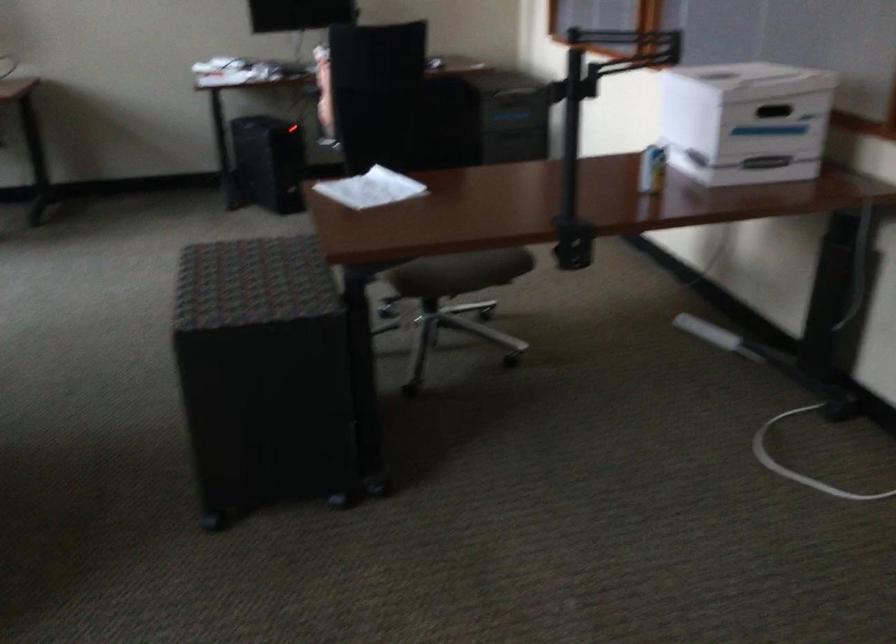
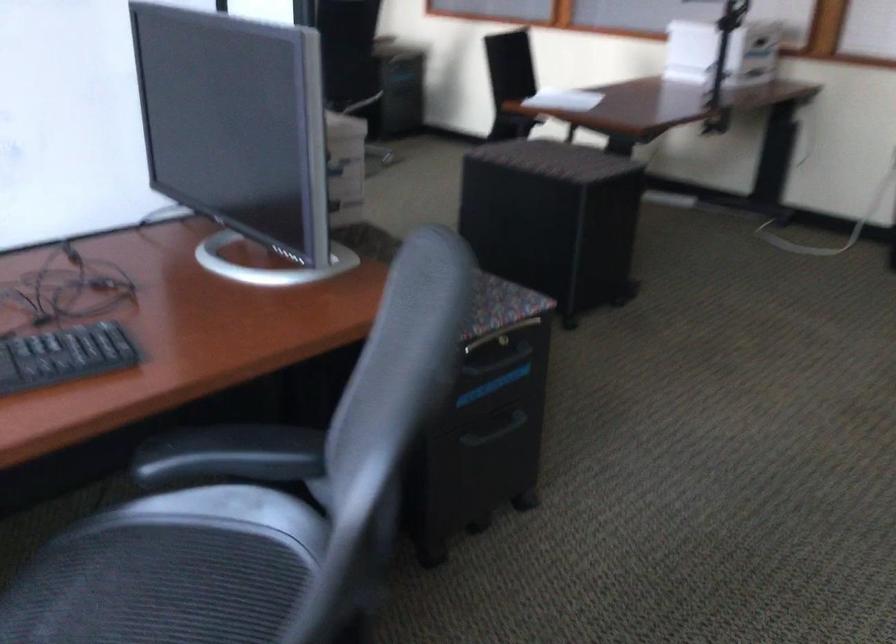
Question: The images are taken continuously from a first-person perspective. In which direction are you moving?

Choices:
 (A) Left
 (B) Right
 (C) Forward
 (D) Backward

Answer: (A)